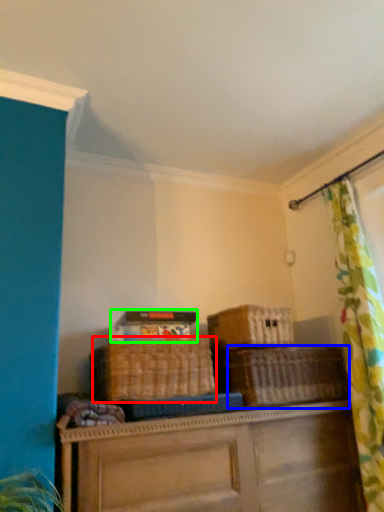
Question: Which is nearer to the basket (highlighted by a red box)? basket (highlighted by a blue box) or storage box (highlighted by a green box).

Choices:
 (A) basket
 (B) storage box

Answer: (B)